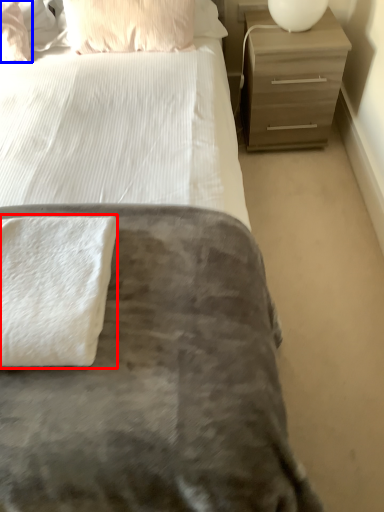
Question: Which object appears closest to the camera in this image, bath towel (highlighted by a red box) or pillow (highlighted by a blue box)?

Choices:
 (A) bath towel
 (B) pillow

Answer: (A)